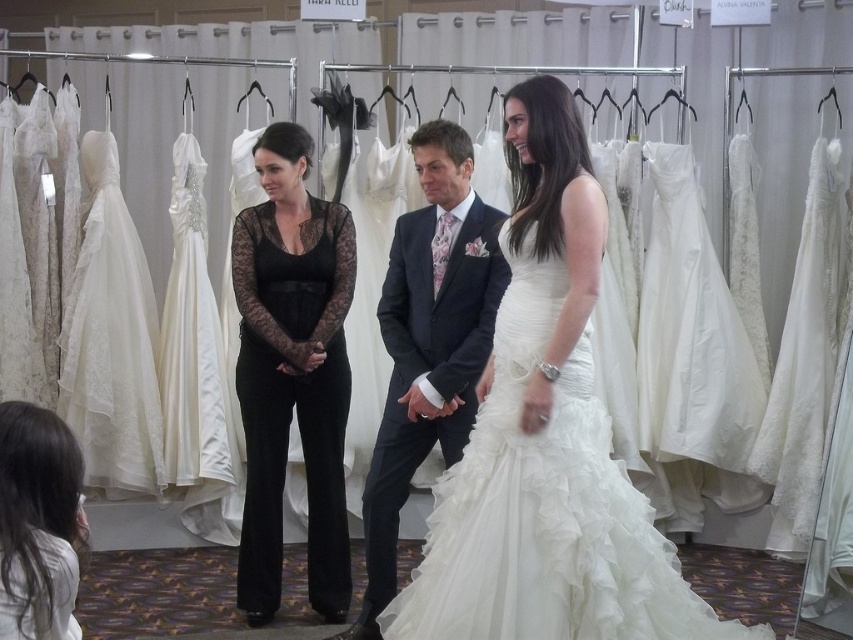
Question: Which point is farther to the camera?

Choices:
 (A) black lace jumpsuit at center
 (B) white satin gown at center
 (C) dark gray suit at center
 (D) smooth white blouse at lower left

Answer: (A)

Question: Is white satin gown at center positioned in front of dark gray suit at center?

Choices:
 (A) yes
 (B) no

Answer: (A)

Question: Which point appears farthest from the camera in this image?

Choices:
 (A) (137, 413)
 (B) (416, 292)

Answer: (A)

Question: From the image, what is the correct spatial relationship of black lace jumpsuit at center in relation to smooth white blouse at lower left?

Choices:
 (A) below
 (B) above

Answer: (B)

Question: Can you confirm if black lace jumpsuit at center is positioned to the left of dark gray suit at center?

Choices:
 (A) yes
 (B) no

Answer: (A)

Question: Which object is positioned closest to the white satin gown at center?

Choices:
 (A) dark gray suit at center
 (B) black lace jumpsuit at center
 (C) ivory lace wedding dress at left

Answer: (A)